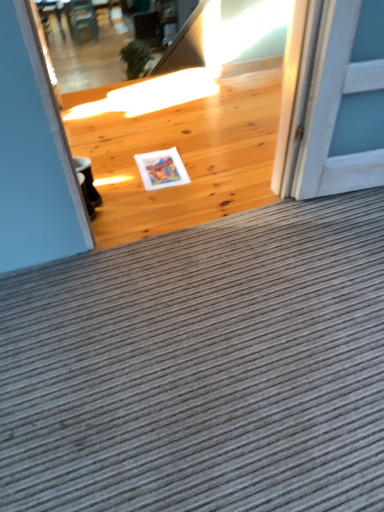
Question: Does white matte postcard at center have a lesser height compared to gray corduroy doormat at center?

Choices:
 (A) no
 (B) yes

Answer: (B)

Question: Is white matte postcard at center bigger than gray corduroy doormat at center?

Choices:
 (A) no
 (B) yes

Answer: (A)

Question: Does white matte postcard at center appear on the right side of gray corduroy doormat at center?

Choices:
 (A) yes
 (B) no

Answer: (B)

Question: Is the depth of white matte postcard at center greater than that of gray corduroy doormat at center?

Choices:
 (A) yes
 (B) no

Answer: (A)

Question: Is gray corduroy doormat at center a part of white matte postcard at center?

Choices:
 (A) yes
 (B) no

Answer: (B)

Question: Considering the relative positions of wooden chair at upper left and gray corduroy doormat at center in the image provided, is wooden chair at upper left to the left or to the right of gray corduroy doormat at center?

Choices:
 (A) right
 (B) left

Answer: (B)

Question: From a real-world perspective, is wooden chair at upper left above or below gray corduroy doormat at center?

Choices:
 (A) above
 (B) below

Answer: (B)

Question: From the image's perspective, is wooden chair at upper left located above or below gray corduroy doormat at center?

Choices:
 (A) below
 (B) above

Answer: (B)

Question: Is wooden chair at upper left situated inside gray corduroy doormat at center or outside?

Choices:
 (A) inside
 (B) outside

Answer: (B)

Question: From the image's perspective, is natural wood floor at center located above or below gray corduroy doormat at center?

Choices:
 (A) below
 (B) above

Answer: (B)

Question: Is natural wood floor at center spatially inside gray corduroy doormat at center, or outside of it?

Choices:
 (A) outside
 (B) inside

Answer: (A)

Question: Considering the positions of point (170, 131) and point (54, 335), is point (170, 131) closer or farther from the camera than point (54, 335)?

Choices:
 (A) closer
 (B) farther

Answer: (B)

Question: In terms of width, does natural wood floor at center look wider or thinner when compared to gray corduroy doormat at center?

Choices:
 (A) thin
 (B) wide

Answer: (A)

Question: Considering the relative positions of gray corduroy doormat at center and natural wood floor at center in the image provided, is gray corduroy doormat at center to the left or to the right of natural wood floor at center?

Choices:
 (A) right
 (B) left

Answer: (A)

Question: Is point (46, 395) positioned closer to the camera than point (99, 152)?

Choices:
 (A) farther
 (B) closer

Answer: (B)